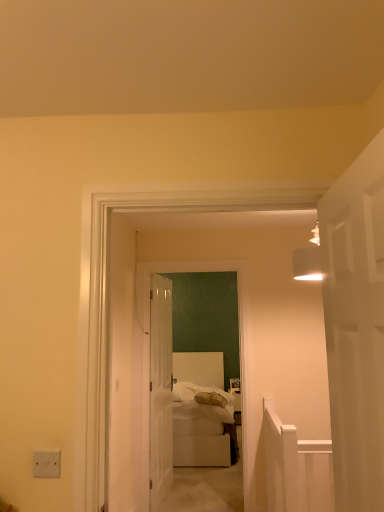
Identify the location of clear glass door at center, marked as the 2th door in a right-to-left arrangement. click(x=160, y=391).

Image resolution: width=384 pixels, height=512 pixels. What do you see at coordinates (239, 336) in the screenshot?
I see `white fabric bed at center` at bounding box center [239, 336].

I want to click on white matte door at right, the second door from the left, so click(x=356, y=327).

Where is `white plastic/light switch at lower left`? The height and width of the screenshot is (512, 384). white plastic/light switch at lower left is located at coordinates (46, 464).

At what (x,y) coordinates should I click in order to perform the action: click on clear glass door at center, which is the first door in back-to-front order. Please return your answer as a coordinate pair (x, y). This screenshot has height=512, width=384. Looking at the image, I should click on (160, 391).

In terms of width, does clear glass door at center, which is the first door in back-to-front order, look wider or thinner when compared to white plastic/light switch at lower left?

In the image, clear glass door at center, which is the first door in back-to-front order, appears to be wider than white plastic/light switch at lower left.

Between clear glass door at center, which ranks as the 1th door in left-to-right order, and white plastic/light switch at lower left, which one has less height?

Standing shorter between the two is white plastic/light switch at lower left.

Locate an element on the screen. Image resolution: width=384 pixels, height=512 pixels. electric outlet above the clear glass door at center, which is the first door in back-to-front order (from a real-world perspective) is located at coordinates (46, 464).

Based on the photo, is clear glass door at center, which is the first door in back-to-front order, in front of or behind white plastic/light switch at lower left in the image?

In the image, clear glass door at center, which is the first door in back-to-front order, appears behind white plastic/light switch at lower left.

Locate an element on the screen. The image size is (384, 512). bedding behind the clear glass door at center, which ranks as the 1th door in left-to-right order is located at coordinates (201, 402).

From a real-world perspective, is clear glass door at center, marked as the 2th door in a right-to-left arrangement, physically above white fluffy bedding at center?

Yes, from a real-world perspective, clear glass door at center, marked as the 2th door in a right-to-left arrangement, is above white fluffy bedding at center.

Is clear glass door at center, which ranks as the 1th door in left-to-right order, shorter than white fluffy bedding at center?

In fact, clear glass door at center, which ranks as the 1th door in left-to-right order, may be taller than white fluffy bedding at center.

How much distance is there between white fabric bed at center and clear glass door at center, marked as the 2th door in a right-to-left arrangement?

A distance of 26.39 inches exists between white fabric bed at center and clear glass door at center, marked as the 2th door in a right-to-left arrangement.

The image size is (384, 512). What are the coordinates of `corridor in front of the clear glass door at center, acting as the 2th door starting from the front` in the screenshot? It's located at (239, 336).

In terms of width, does white fabric bed at center look wider or thinner when compared to clear glass door at center, marked as the 2th door in a right-to-left arrangement?

Clearly, white fabric bed at center has more width compared to clear glass door at center, marked as the 2th door in a right-to-left arrangement.

Is white fabric bed at center at the back of clear glass door at center, which is the first door in back-to-front order?

No, clear glass door at center, which is the first door in back-to-front order, is not facing away from white fabric bed at center.

Considering the relative positions of clear glass door at center, acting as the 2th door starting from the front, and white fabric bed at center in the image provided, is clear glass door at center, acting as the 2th door starting from the front, to the right of white fabric bed at center from the viewer's perspective?

No.

From the image's perspective, is clear glass door at center, marked as the 2th door in a right-to-left arrangement, below white fabric bed at center?

Yes, from the image's perspective, clear glass door at center, marked as the 2th door in a right-to-left arrangement, is below white fabric bed at center.

Measure the distance between clear glass door at center, which ranks as the 1th door in left-to-right order, and white fabric bed at center.

clear glass door at center, which ranks as the 1th door in left-to-right order, and white fabric bed at center are 26.39 inches apart from each other.

In the image, is white plastic/light switch at lower left positioned in front of or behind white matte door at right, which is counted as the first door, starting from the right?

white plastic/light switch at lower left is behind white matte door at right, which is counted as the first door, starting from the right.

Is white plastic/light switch at lower left directly adjacent to white matte door at right, the second door when ordered from back to front?

They are not placed beside each other.

What's the angular difference between white plastic/light switch at lower left and white matte door at right, the first door from the front,'s facing directions?

There is a 90.1-degree angle between the facing directions of white plastic/light switch at lower left and white matte door at right, the first door from the front.

Which object is wider, white plastic/light switch at lower left or white matte door at right, the first door from the front?

With larger width is white matte door at right, the first door from the front.

From a real-world perspective, relative to white fluffy bedding at center, is white plastic/light switch at lower left vertically above or below?

Clearly, from a real-world perspective, white plastic/light switch at lower left is above white fluffy bedding at center.

From the image's perspective, is white plastic/light switch at lower left located above or below white fluffy bedding at center?

white plastic/light switch at lower left is situated higher than white fluffy bedding at center in the image.

Is white fluffy bedding at center at the back of white plastic/light switch at lower left?

Yes, white plastic/light switch at lower left is facing away from white fluffy bedding at center.

Is white plastic/light switch at lower left wider than white fluffy bedding at center?

No, white plastic/light switch at lower left is not wider than white fluffy bedding at center.

Which is correct: white fabric bed at center is inside white fluffy bedding at center, or outside of it?

The correct answer is: outside.

Is white fabric bed at center not close to white fluffy bedding at center?

Yes.

The image size is (384, 512). I want to click on electric outlet on the left of the clear glass door at center, marked as the 2th door in a right-to-left arrangement, so click(x=46, y=464).

In the image, there is a clear glass door at center, which is the first door in back-to-front order. Where is `bedding below it (from the image's perspective)`? bedding below it (from the image's perspective) is located at coordinates (201, 402).

From the image, which object appears to be nearer to white matte door at right, the first door from the front, white fabric bed at center or white fluffy bedding at center?

white fabric bed at center lies closer to white matte door at right, the first door from the front, than the other object.

Considering their positions, is white soft bed at center positioned closer to white plastic/light switch at lower left than white matte door at right, the second door from the left?

white matte door at right, the second door from the left, is closer to white plastic/light switch at lower left.

Estimate the real-world distances between objects in this image. Which object is further from white fabric bed at center, white plastic/light switch at lower left or white soft bed at center?

The object further to white fabric bed at center is white plastic/light switch at lower left.

Estimate the real-world distances between objects in this image. Which object is further from clear glass door at center, which ranks as the 1th door in left-to-right order, white fabric bed at center or white matte door at right, the first door from the front?

Among the two, white matte door at right, the first door from the front, is located further to clear glass door at center, which ranks as the 1th door in left-to-right order.

Based on their spatial positions, is white plastic/light switch at lower left or clear glass door at center, acting as the 2th door starting from the front, closer to white fluffy bedding at center?

The object closer to white fluffy bedding at center is clear glass door at center, acting as the 2th door starting from the front.

When comparing their distances from clear glass door at center, which ranks as the 1th door in left-to-right order, does white plastic/light switch at lower left or white soft bed at center seem further?

white plastic/light switch at lower left.

From the image, which object appears to be farther from white fluffy bedding at center, white soft bed at center or clear glass door at center, acting as the 2th door starting from the front?

clear glass door at center, acting as the 2th door starting from the front, is further to white fluffy bedding at center.

From the image, which object appears to be nearer to white plastic/light switch at lower left, white fluffy bedding at center or white matte door at right, the second door when ordered from back to front?

Based on the image, white matte door at right, the second door when ordered from back to front, appears to be nearer to white plastic/light switch at lower left.

I want to click on corridor between white plastic/light switch at lower left and clear glass door at center, which is the first door in back-to-front order, from front to back, so click(x=239, y=336).

This screenshot has width=384, height=512. I want to click on door between white fabric bed at center and white soft bed at center in the front-back direction, so click(160, 391).

At what (x,y) coordinates should I click in order to perform the action: click on door located between white plastic/light switch at lower left and white fluffy bedding at center in the depth direction. Please return your answer as a coordinate pair (x, y). This screenshot has height=512, width=384. Looking at the image, I should click on (160, 391).

At what (x,y) coordinates should I click in order to perform the action: click on corridor between white matte door at right, which is counted as the first door, starting from the right, and white fluffy bedding at center, along the z-axis. Please return your answer as a coordinate pair (x, y). The height and width of the screenshot is (512, 384). Looking at the image, I should click on (239, 336).